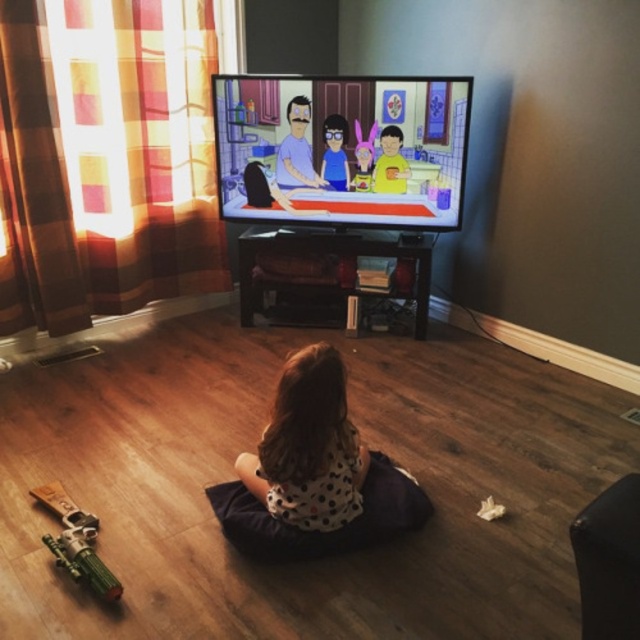
You are a parent trying to clean up the living room. You see the cartoon characters at upper center and the polka dot fabric at center. Which object is higher up in the room?

The cartoon characters at upper center are higher up in the room because they are located above the polka dot fabric at center.

You are a parent who wants to ensure the child can see the cartoon characters at upper center clearly. Considering the polka dot fabric at center, which object is higher up in the image?

The cartoon characters at upper center are much taller than the polka dot fabric at center, so the cartoon characters at upper center are higher up in the image.

You are a parent who wants to place a new toy that is 15 cm wide on the floor between the white dotted fabric at center and the green plastic toy gun at lower left. Can the space between them accommodate the new toy?

The white dotted fabric at center is wider than the green plastic toy gun at lower left. However, the exact distance between them isn generated in the provided information, so it is unclear if the 15 cm wide toy can fit. Please check the actual space available.